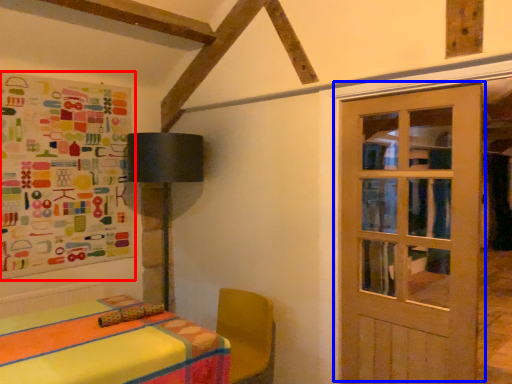
Question: Which point is closer to the camera, bulletin board (highlighted by a red box) or door (highlighted by a blue box)?

Choices:
 (A) bulletin board
 (B) door

Answer: (B)